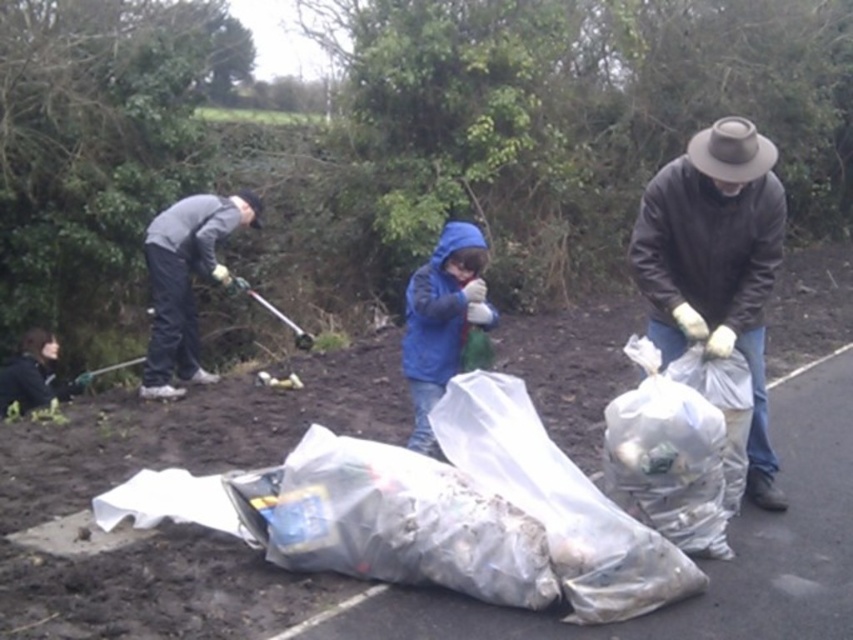
You are a photographer trying to capture a clear shot of the blue fleece jacket at center and the brown felt cowboy hat at upper right. Since you want both subjects to be in focus, you need to know which one is taller. Can you determine which object is taller?

The blue fleece jacket at center is taller than the brown felt cowboy hat at upper right according to the description, so you should focus on the blue fleece jacket at center first as it requires a closer focus due to its height.